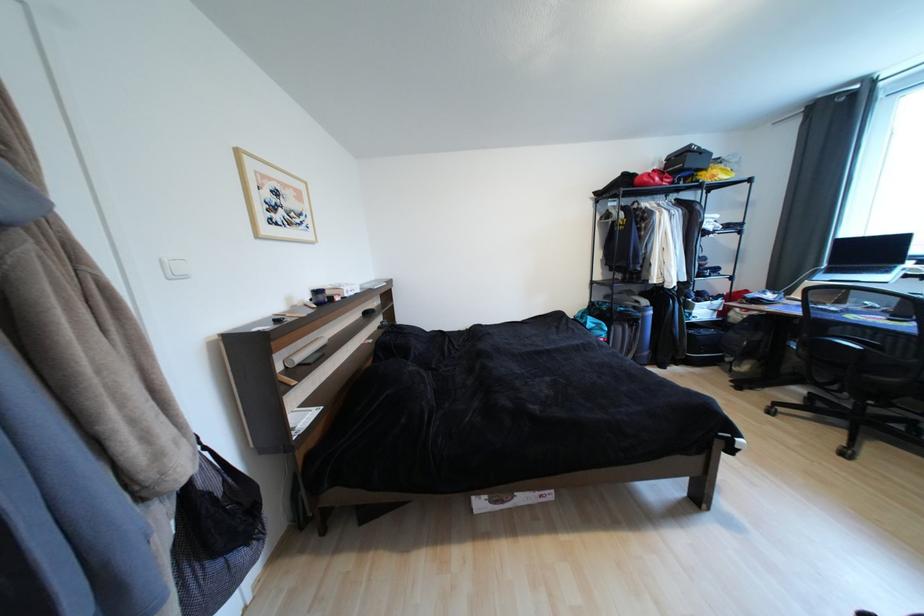
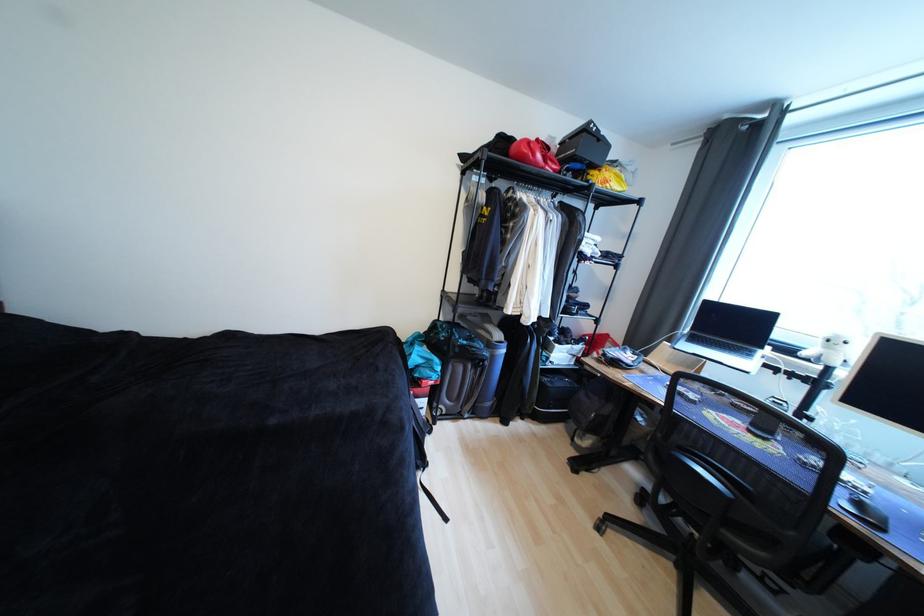
Find the pixel in the second image that matches point (651, 185) in the first image.

(529, 159)